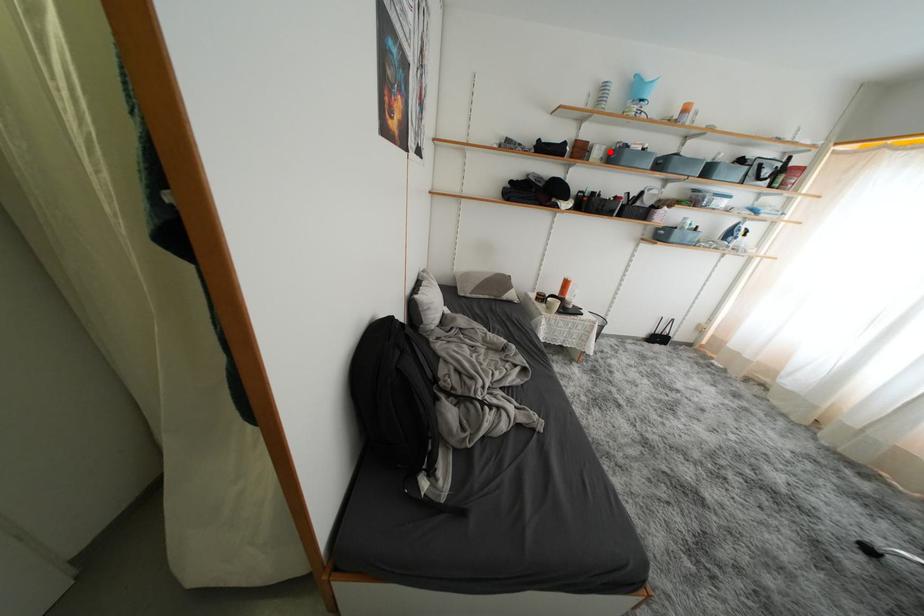
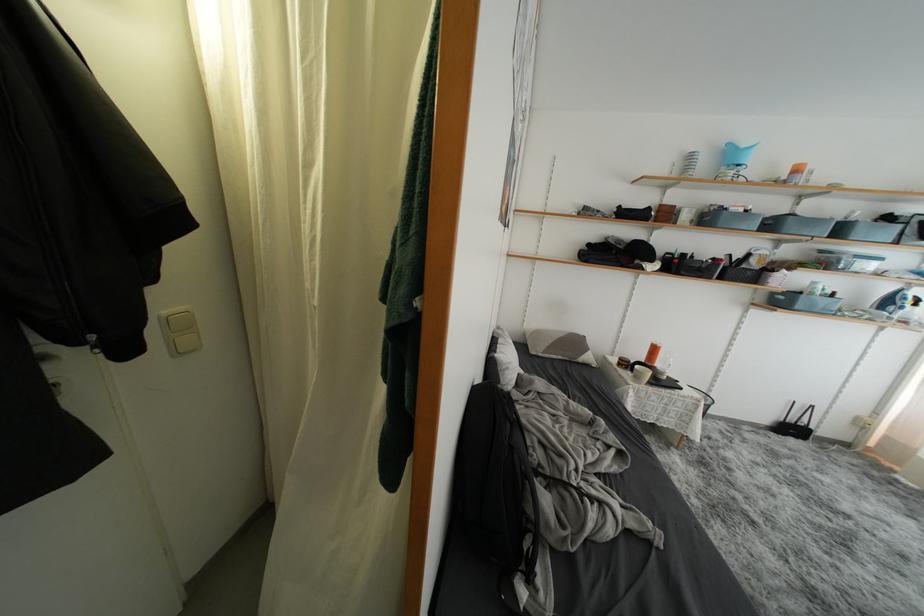
Where in the second image is the point corresponding to the highlighted location from the first image?

(700, 215)